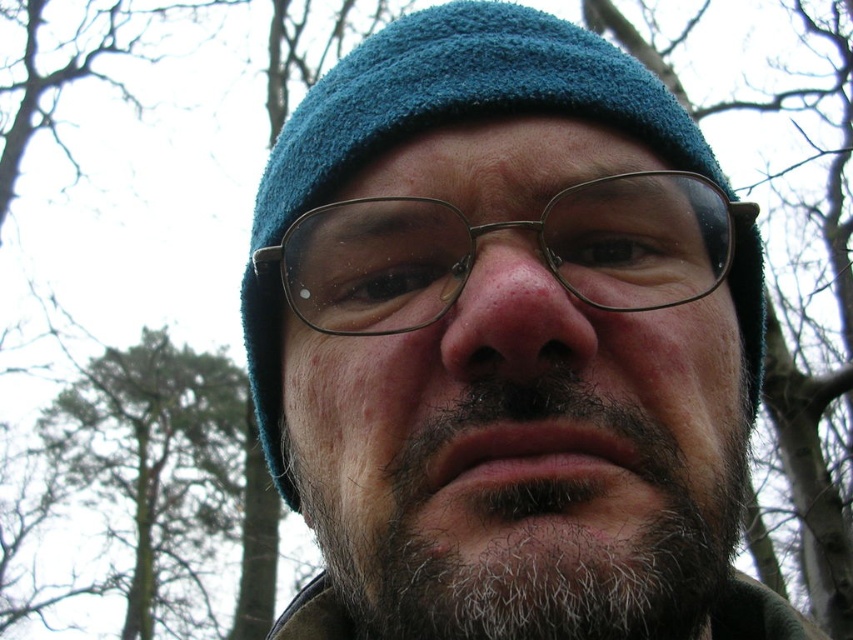
Question: Considering the relative positions of metallic brown glasses at center and green leafy tree at left in the image provided, where is metallic brown glasses at center located with respect to green leafy tree at left?

Choices:
 (A) above
 (B) below

Answer: (A)

Question: Does green leafy tree at left appear on the left side of dry matte nose at center?

Choices:
 (A) yes
 (B) no

Answer: (A)

Question: Is metallic brown glasses at center smaller than dry skin at center?

Choices:
 (A) no
 (B) yes

Answer: (A)

Question: Among these points, which one is nearest to the camera?

Choices:
 (A) (635, 509)
 (B) (642, 465)

Answer: (A)

Question: Which is farther from the metallic brown glasses at center?

Choices:
 (A) gray/woolly beard at center
 (B) dry skin at center
 (C) green leafy tree at left

Answer: (C)

Question: Which object is positioned farthest from the gray/woolly beard at center?

Choices:
 (A) dry matte nose at center
 (B) green leafy tree at left
 (C) dry skin at center
 (D) metallic brown glasses at center

Answer: (B)